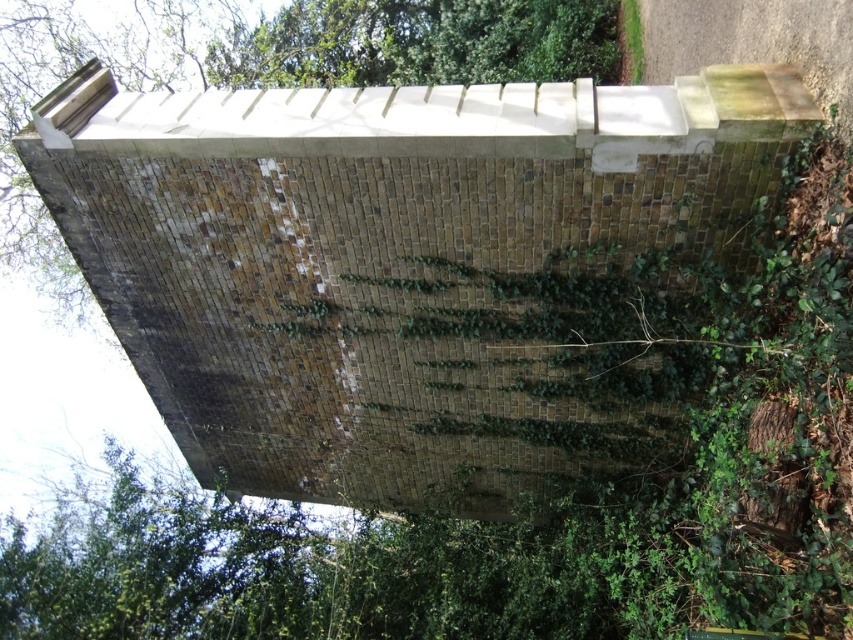
Can you confirm if brick wall at center is wider than green leafy tree at upper center?

Yes.

Is point (555, 77) farther from camera compared to point (289, 4)?

No.

Locate an element on the screen. This screenshot has height=640, width=853. brick wall at center is located at coordinates (276, 72).